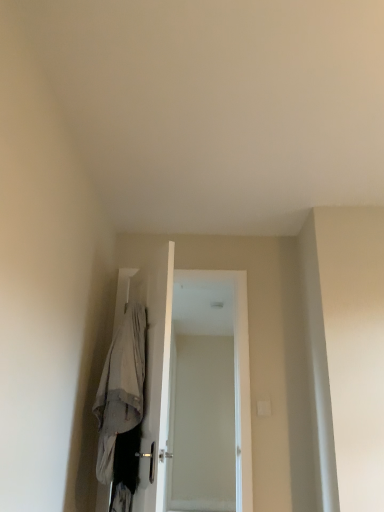
Question: Should I look upward or downward to see light gray fabric robe at center?

Choices:
 (A) down
 (B) up

Answer: (A)

Question: Can you confirm if light gray fabric robe at center is thinner than white glossy screen door at center?

Choices:
 (A) no
 (B) yes

Answer: (A)

Question: Is the depth of light gray fabric robe at center greater than that of white glossy screen door at center?

Choices:
 (A) no
 (B) yes

Answer: (A)

Question: Is light gray fabric robe at center aimed at white glossy screen door at center?

Choices:
 (A) yes
 (B) no

Answer: (B)

Question: From the image's perspective, would you say light gray fabric robe at center is shown under white glossy screen door at center?

Choices:
 (A) no
 (B) yes

Answer: (A)

Question: Is light gray fabric robe at center oriented away from white glossy screen door at center?

Choices:
 (A) no
 (B) yes

Answer: (A)

Question: Are light gray fabric robe at center and white glossy screen door at center far apart?

Choices:
 (A) no
 (B) yes

Answer: (A)

Question: Considering the relative sizes of white glossy screen door at center and light gray fabric robe at center in the image provided, is white glossy screen door at center wider than light gray fabric robe at center?

Choices:
 (A) yes
 (B) no

Answer: (B)

Question: Can you confirm if white glossy screen door at center is shorter than light gray fabric robe at center?

Choices:
 (A) yes
 (B) no

Answer: (B)

Question: Is white glossy screen door at center far from light gray fabric robe at center?

Choices:
 (A) no
 (B) yes

Answer: (A)

Question: From the image's perspective, would you say white glossy screen door at center is shown under light gray fabric robe at center?

Choices:
 (A) yes
 (B) no

Answer: (A)

Question: Is white glossy screen door at center facing towards light gray fabric robe at center?

Choices:
 (A) yes
 (B) no

Answer: (A)

Question: From a real-world perspective, is white glossy screen door at center on light gray fabric robe at center?

Choices:
 (A) no
 (B) yes

Answer: (B)

Question: From the image's perspective, relative to white glossy screen door at center, is light gray fabric robe at center above or below?

Choices:
 (A) below
 (B) above

Answer: (B)